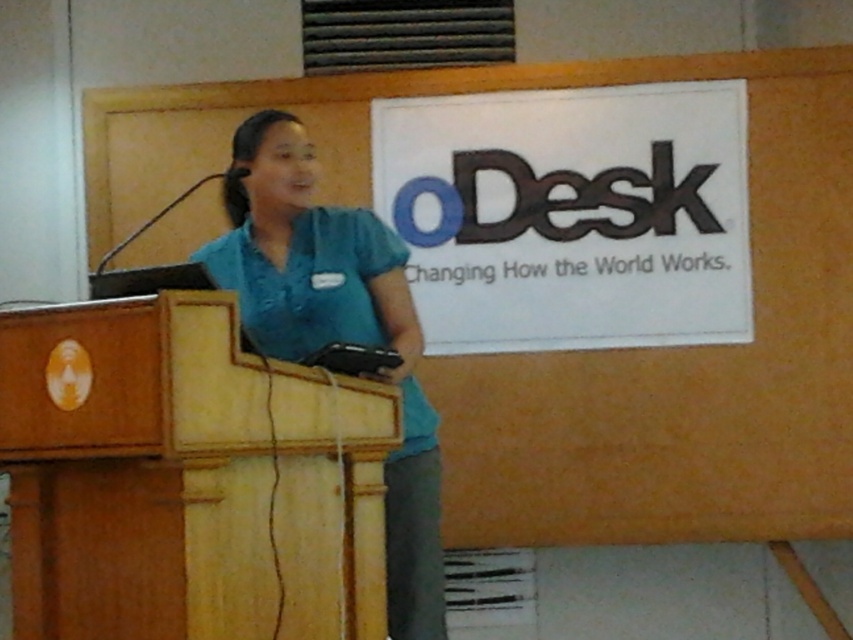
Question: Which of the following is the closest to the observer?

Choices:
 (A) (289, 256)
 (B) (241, 637)

Answer: (B)

Question: Which of the following is the closest to the observer?

Choices:
 (A) wooden podium at center
 (B) teal fabric shirt at center

Answer: (A)

Question: Is wooden podium at center above teal fabric shirt at center?

Choices:
 (A) no
 (B) yes

Answer: (A)

Question: Does wooden podium at center lie in front of teal fabric shirt at center?

Choices:
 (A) yes
 (B) no

Answer: (A)

Question: In this image, where is wooden podium at center located relative to teal fabric shirt at center?

Choices:
 (A) below
 (B) above

Answer: (A)